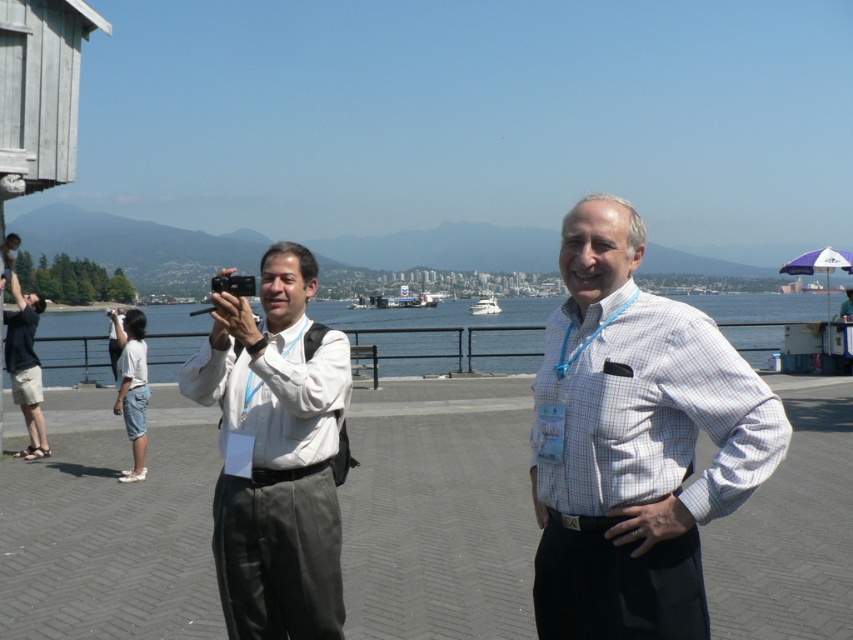
Describe the element at coordinates (447, 333) in the screenshot. The width and height of the screenshot is (853, 640). I see `clear blue water at center` at that location.

How much distance is there between clear blue water at center and white denim shorts at lower left?

They are 42.69 meters apart.

The width and height of the screenshot is (853, 640). I want to click on clear blue water at center, so click(447, 333).

Can you confirm if white checkered shirt at center is positioned to the right of white glossy boat at center?

No, white checkered shirt at center is not to the right of white glossy boat at center.

Which is more to the left, white checkered shirt at center or white glossy boat at center?

From the viewer's perspective, white checkered shirt at center appears more on the left side.

Who is more forward, (538,520) or (490,305)?

Positioned in front is point (538,520).

Locate an element on the screen. white checkered shirt at center is located at coordinates (634, 442).

Does matte black shirt at left have a greater height compared to black plastic camera at center?

Yes.

Is matte black shirt at left shorter than black plastic camera at center?

In fact, matte black shirt at left may be taller than black plastic camera at center.

Identify the location of matte black shirt at left. This screenshot has height=640, width=853. (25, 365).